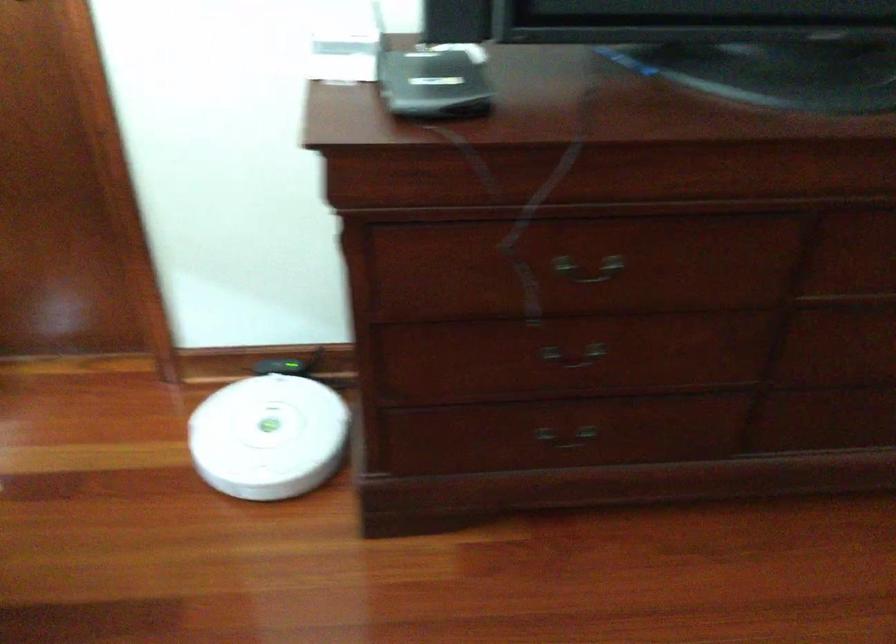
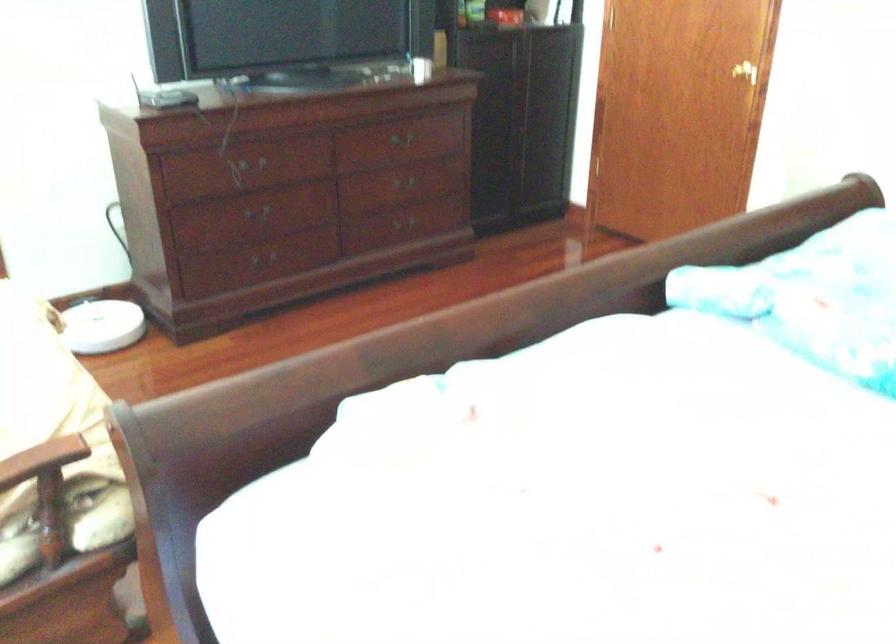
Locate, in the second image, the point that corresponds to (x=271, y=446) in the first image.

(101, 326)